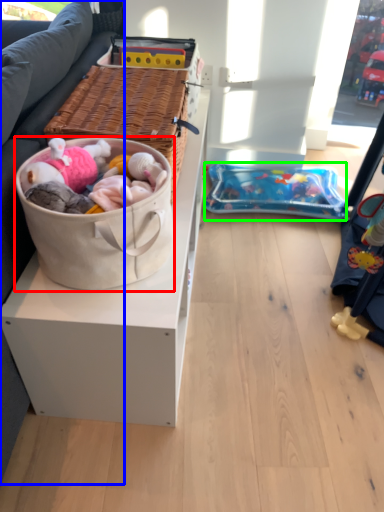
Question: Which is nearer to the gift basket (highlighted by a red box)? studio couch (highlighted by a blue box) or infant bed (highlighted by a green box).

Choices:
 (A) studio couch
 (B) infant bed

Answer: (A)